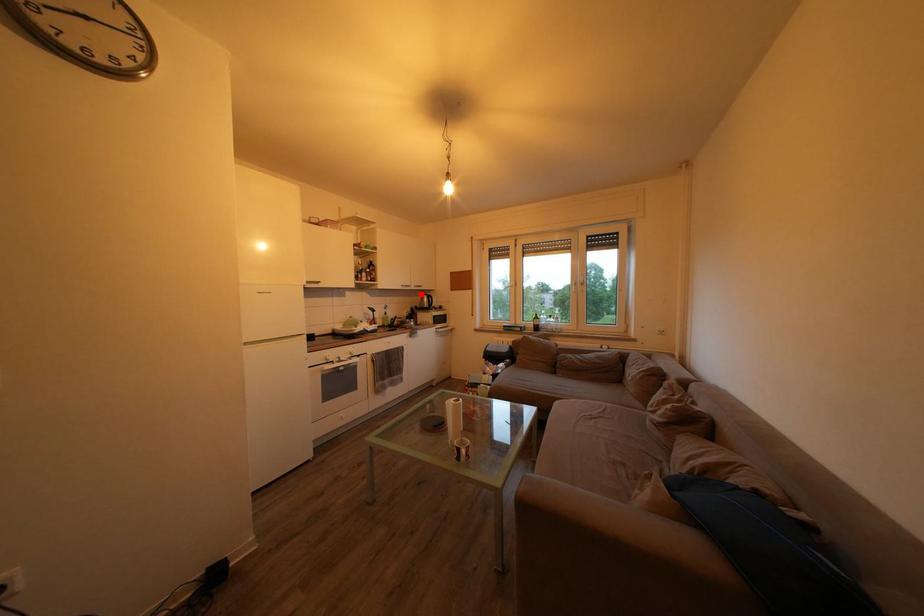
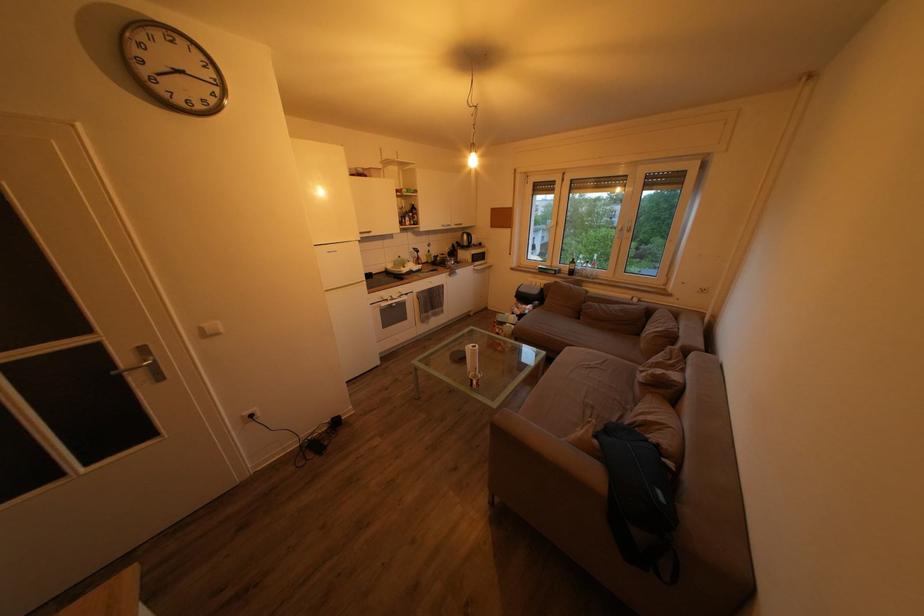
Question: I am providing you with two images of the same scene from different viewpoints. A red point is shown in image1. For the corresponding object point in image2, is it positioned nearer or farther from the camera?

Choices:
 (A) Nearer
 (B) Farther

Answer: (A)